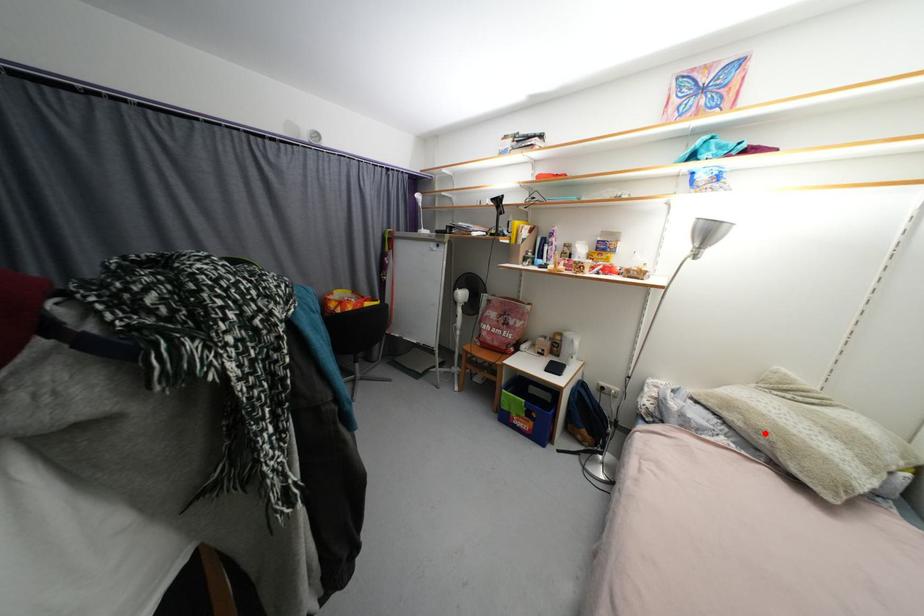
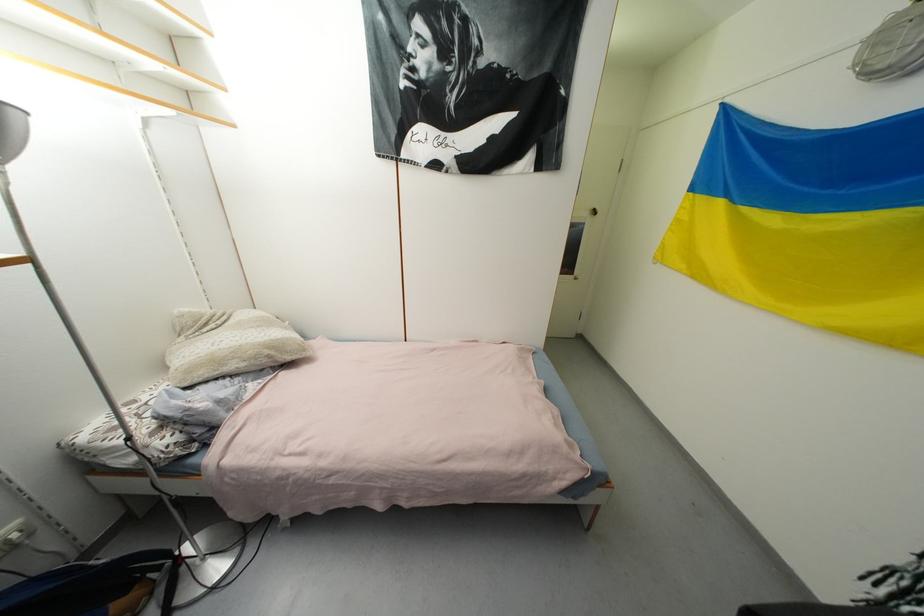
Question: I am providing you with two images of the same scene from different viewpoints. In image1, a red point is highlighted. Considering the same 3D point in image2, which of the following is correct?

Choices:
 (A) It is closer
 (B) It is farther

Answer: (A)